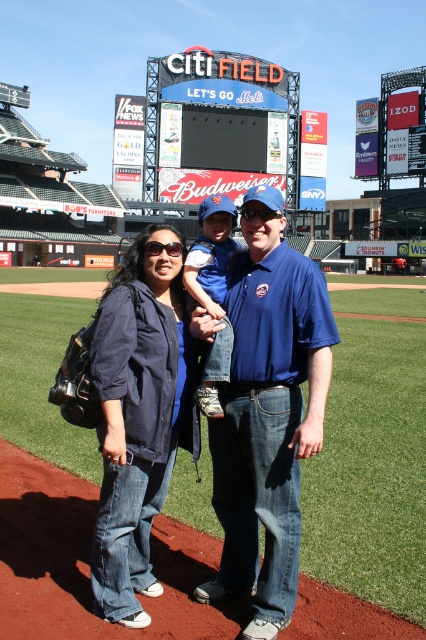
Question: Observing the image, what is the correct spatial positioning of denim jacket at lower left in reference to neon sign at upper center?

Choices:
 (A) right
 (B) left

Answer: (B)

Question: Which object is farther from the camera taking this photo?

Choices:
 (A) neon sign at upper center
 (B) blue cotton shirt at center
 (C) denim jacket at lower left

Answer: (A)

Question: Which point is farther to the camera?

Choices:
 (A) neon sign at upper center
 (B) denim jacket at lower left
 (C) blue cotton shirt at center

Answer: (A)

Question: Which of these objects is positioned closest to the blue cotton shirt at center?

Choices:
 (A) denim jacket at lower left
 (B) neon sign at upper center

Answer: (A)

Question: Can you confirm if denim jacket at lower left is positioned above neon sign at upper center?

Choices:
 (A) no
 (B) yes

Answer: (A)

Question: Is blue cotton shirt at center further to the viewer compared to neon sign at upper center?

Choices:
 (A) yes
 (B) no

Answer: (B)